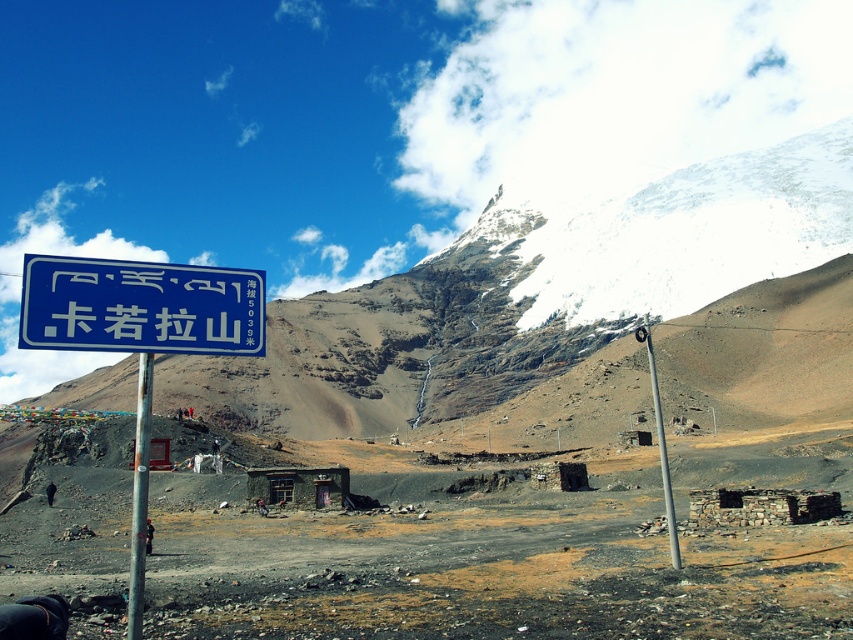
You are a hiker who wants to place a 1.2 meter wide tent between the blue plastic sign at center and the metallic pole at right. Can you fit the tent there?

The blue plastic sign at center is smaller than the metallic pole at right, but the description does not provide information about the distance between them. Therefore, it is impossible to determine if the tent will fit.